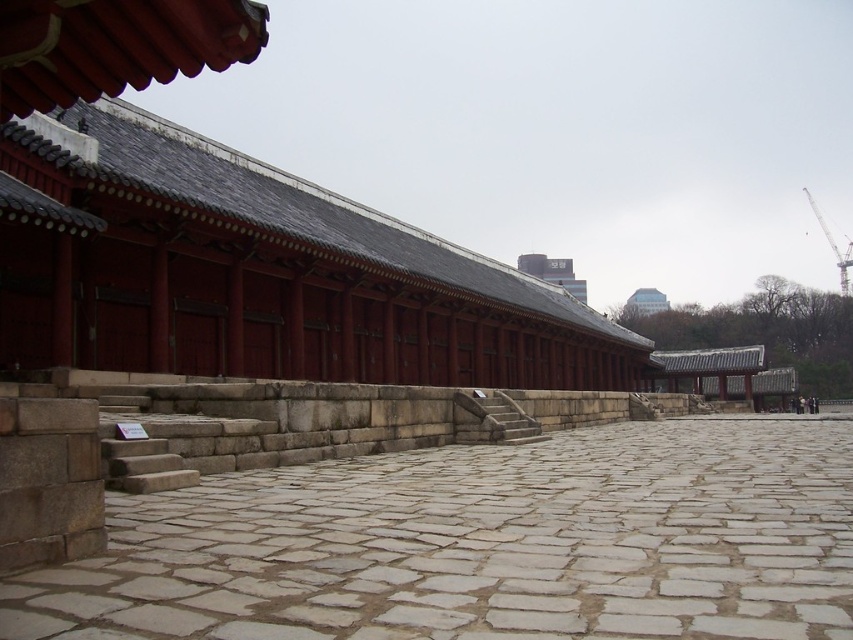
You are standing in the courtyard of the traditional Korean architectural structure. You need to place a small decorative stone exactly at the center of the matte red wood palace at center. Given that the palace is positioned at coordinates point 0.425, 0.304, can you determine the exact coordinates where you should place the stone?

The exact coordinates to place the small decorative stone at the center of the matte red wood palace at center would be (258,272), as that is the location specified for the palace.

You are a tourist visiting this historical site and want to take a photo of the stone textured stairs at center and the white glass building at upper center. Which object should you focus on first if you want to capture both in a single frame without moving your camera?

You should focus on the stone textured stairs at center first because it is closer to you than the white glass building at upper center, allowing both to be in the same frame.

Looking at this image, you are standing at the entrance of the traditional Korean building and want to reach the courtyard. Where are the stone textured stairs at center located relative to your position?

The stone textured stairs at center are located at point 0.656 on the x axis and 0.577 on the y axis relative to your position.